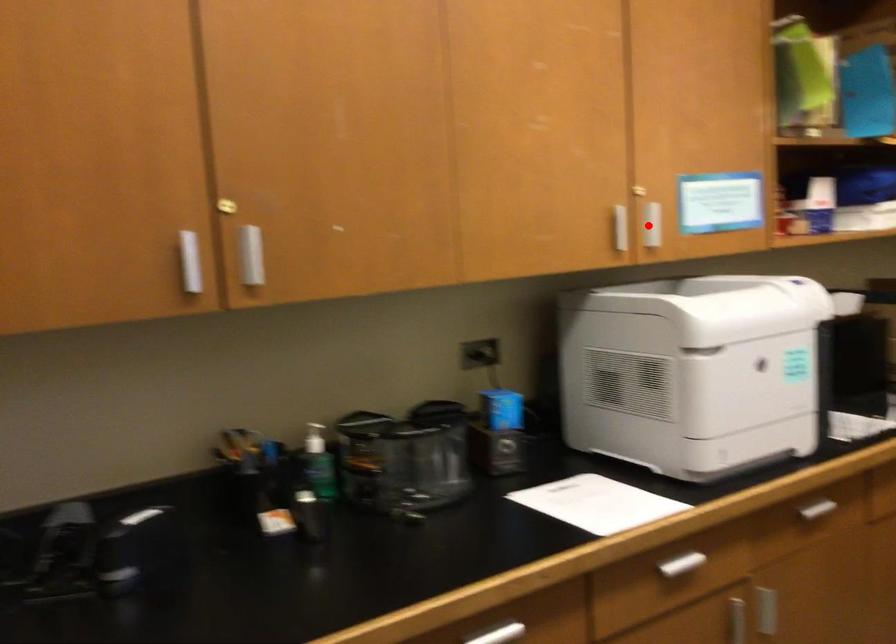
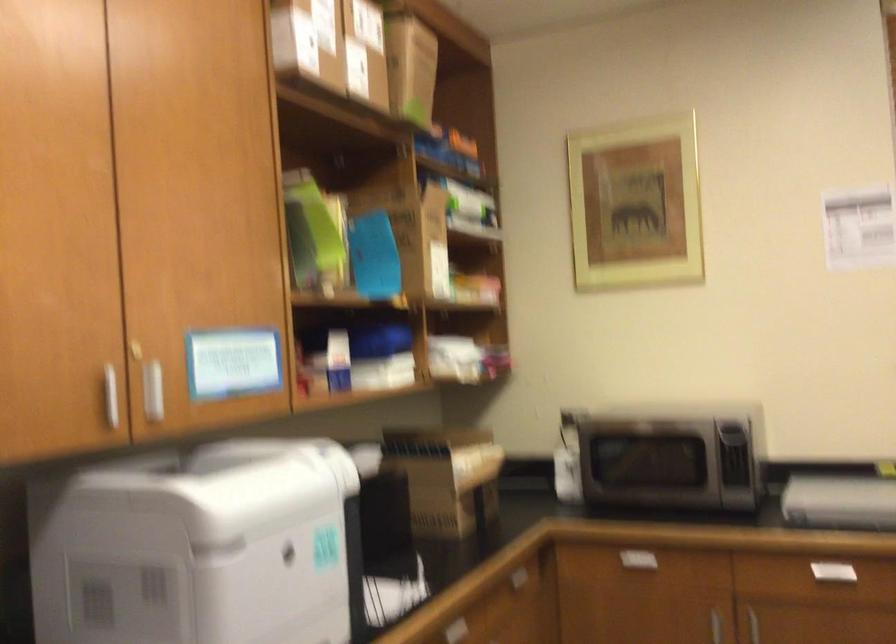
Question: A red point is marked in image1. In image2, is the corresponding 3D point closer to the camera or farther? Reply with the corresponding letter.

Choices:
 (A) The corresponding 3D point is closer.
 (B) The corresponding 3D point is farther.

Answer: (A)